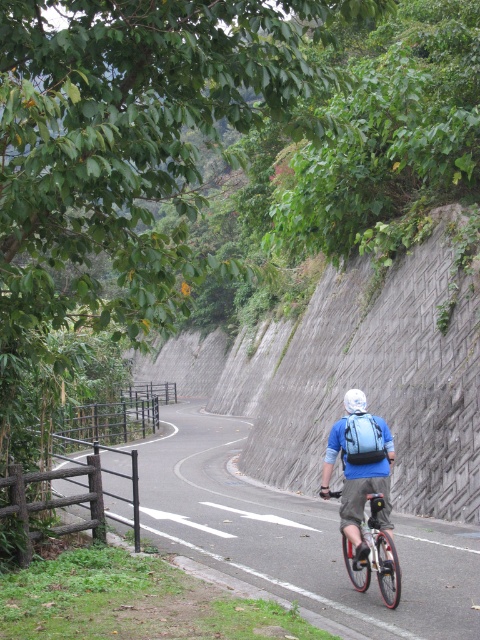
You are a drone operator trying to capture the cyclist from above. You have two points marked on your screen, point A at coordinates point [391,556] and point B at coordinates point [360,394]. Which point is closer to your drone camera lens?

Point point [391,556] is closer to the viewer than point point [360,394], so the drone camera lens is closer to point point [391,556].

You are a delivery drone flying above the cyclist. You need to drop a package onto the asphalt road at center without hitting the blue fabric backpack at center. What is the minimum horizontal distance you should maintain between the package and the backpack?

The minimum horizontal distance you should maintain between the package and the blue fabric backpack at center is 5.70 meters, as the asphalt road at center is 5.70 meters away from the backpack.

You are a delivery person riding a metallic silver bicycle at center. You need to cross a small hill on the asphalt road at center. Considering the height difference between the bicycle and the road, will the bicycle be able to clear the hill without any part touching the ground?

The asphalt road at center has a greater height compared to the metallic silver bicycle at center. This means the bicycle is lower than the road, so it should be able to clear the hill without any part touching the ground as long as the hill is within the bicycle and rider capabilities.